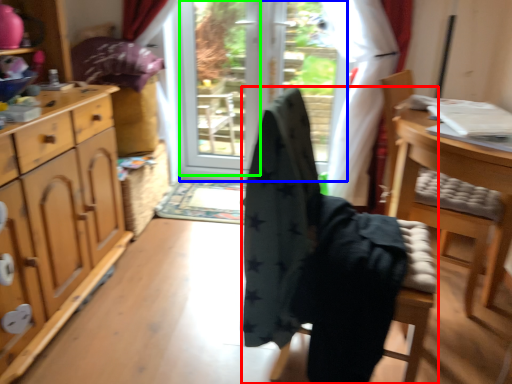
Question: Which is nearer to the chair (highlighted by a red box)? screen door (highlighted by a blue box) or screen door (highlighted by a green box).

Choices:
 (A) screen door
 (B) screen door

Answer: (A)